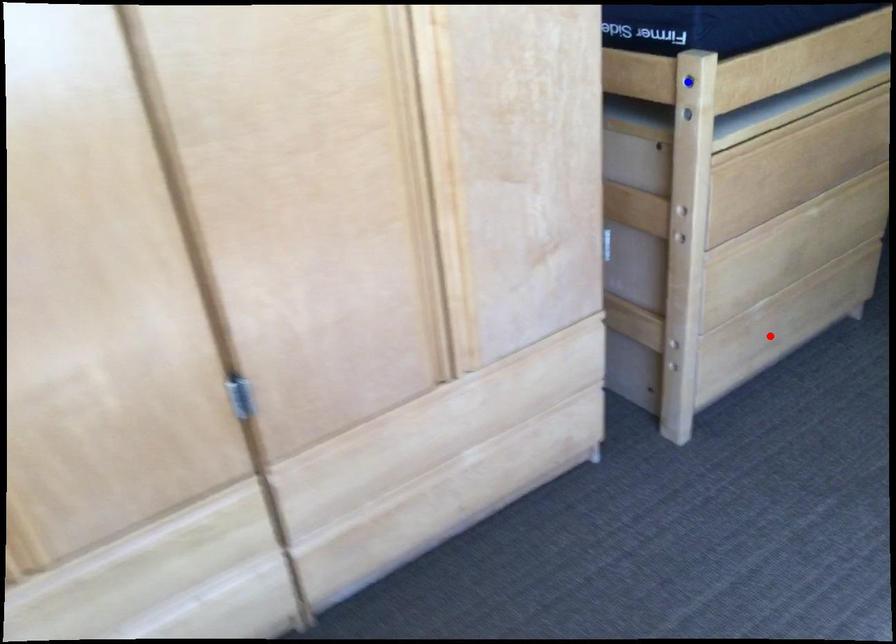
Question: Two points are marked on the image. Which point is closer to the camera?

Choices:
 (A) Blue point is closer.
 (B) Red point is closer.

Answer: (A)